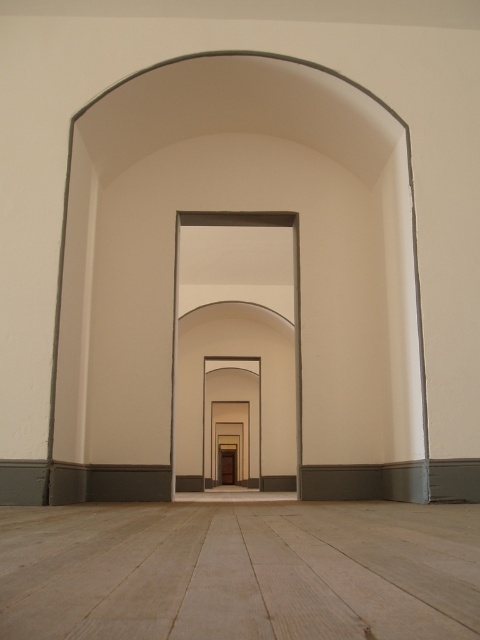
You are a painter who needs to move a 2.5 meter long ladder from the entrance to the end of the corridor. The ladder is too long to carry upright. You decide to lay it flat. Is the distance between the light wood floor at center and the smooth white archway at center sufficient to carry it without lifting?

The distance between the light wood floor at center and the smooth white archway at center is 7.60 meters, which is longer than the ladder length of 2.5 meters. Therefore, the distance is sufficient to carry the ladder without lifting it.

You are standing in the corridor and want to place a large decorative rug. The rug is the same size as the light wood floor at center. Will the rug cover the entire smooth white archway at center?

The light wood floor at center is smaller than the smooth white archway at center, so the rug, being the same size as the floor, will not be large enough to cover the entire smooth white archway at center.

You are standing at the entrance of the corridor and notice the light wood floor at center and the smooth white archway at center. Which one appears taller from your perspective?

The smooth white archway at center appears taller than the light wood floor at center because the description states that the light wood floor at center has a lesser height compared to the smooth white archway at center.